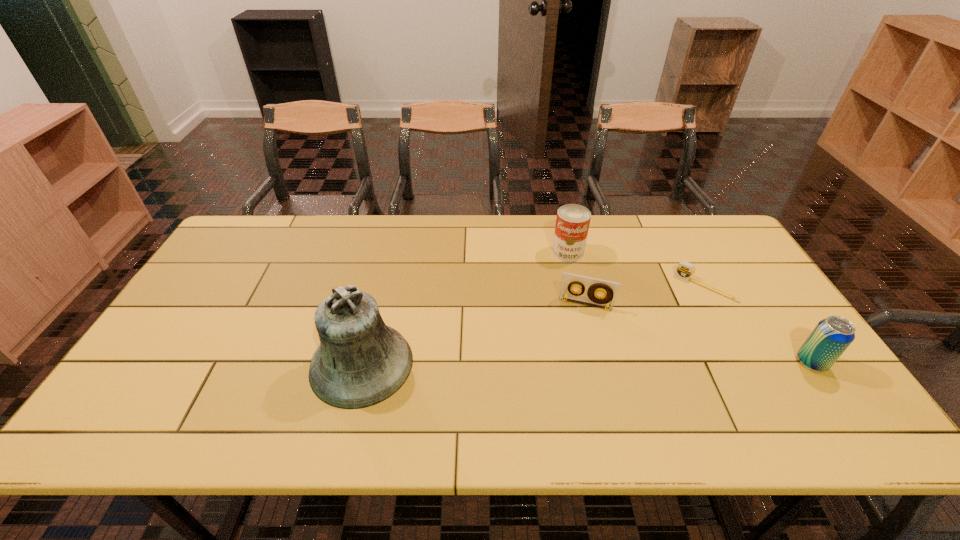
Identify the location of blank region between the farthest object and the bell. The image size is (960, 540). (465, 308).

Locate an element on the screen. This screenshot has height=540, width=960. vacant area that lies between the fourth tallest object and the leftmost object is located at coordinates (473, 334).

Locate an element on the screen. This screenshot has width=960, height=540. free space between the rightmost object and the can is located at coordinates (689, 307).

Locate an element on the screen. empty space between the tape measure and the bell is located at coordinates (534, 326).

The width and height of the screenshot is (960, 540). I want to click on empty space between the rightmost object and the can, so click(x=689, y=307).

Identify the location of free space between the bell and the second shortest object. (473, 334).

The height and width of the screenshot is (540, 960). I want to click on free space between the farthest object and the beer can, so click(689, 307).

Locate which object is the third closest to the leftmost object. Please provide its 2D coordinates. Your answer should be formatted as a tuple, i.e. [(x, y)], where the tuple contains the x and y coordinates of a point satisfying the conditions above.

[(685, 270)]

At what (x,y) coordinates should I click in order to perform the action: click on the third closest object to the tallest object. Please return your answer as a coordinate pair (x, y). Image resolution: width=960 pixels, height=540 pixels. Looking at the image, I should click on (685, 270).

Find the location of a particular element. The image size is (960, 540). free point that satisfies the following two spatial constraints: 1. on the front side of the videotape; 2. on the right side of the beer can is located at coordinates (600, 362).